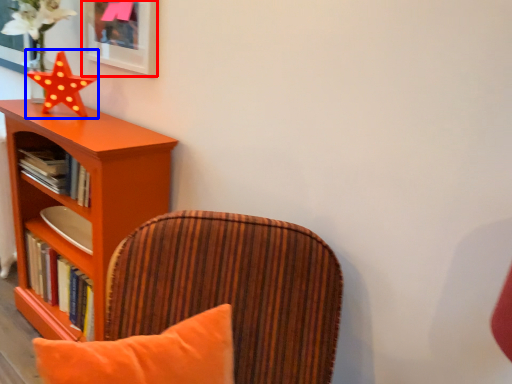
Question: Which object is further to the camera taking this photo, picture frame (highlighted by a red box) or star (highlighted by a blue box)?

Choices:
 (A) picture frame
 (B) star

Answer: (B)